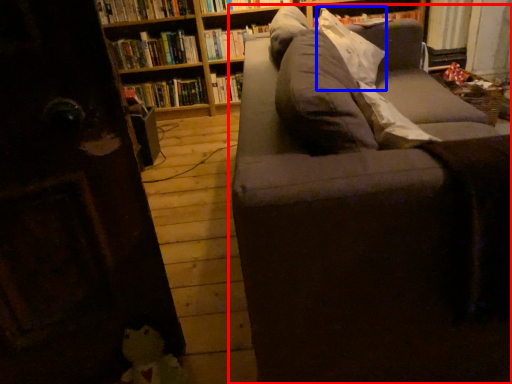
Question: Which of the following is the farthest to the observer, studio couch (highlighted by a red box) or pillow (highlighted by a blue box)?

Choices:
 (A) studio couch
 (B) pillow

Answer: (B)